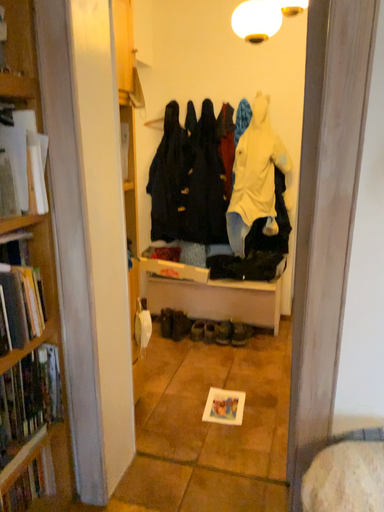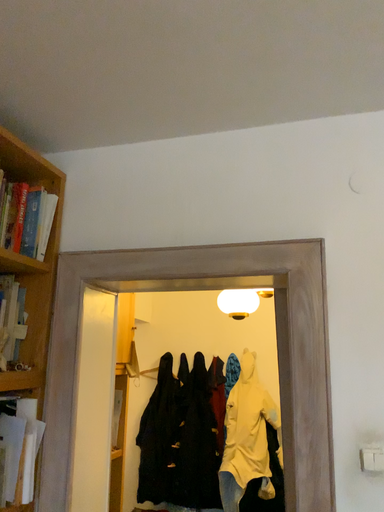
Question: Which way did the camera rotate in the video?

Choices:
 (A) rotated downward
 (B) rotated upward

Answer: (B)